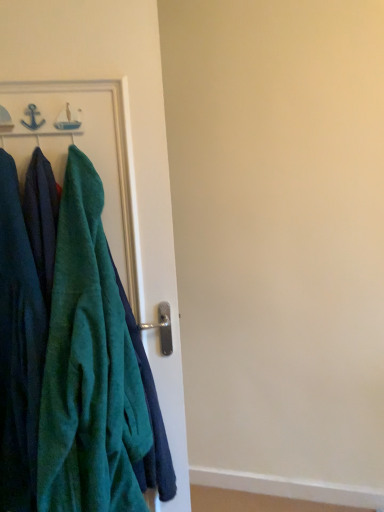
You are a GUI agent. You are given a task and a screenshot of the screen. Output one action in this format:
    pyautogui.click(x=<x>, y=<y>)
    Task: Click on the velvety green towel at left
    
    Given the screenshot: What is the action you would take?
    pyautogui.click(x=89, y=367)

What do you see at coordinates (89, 367) in the screenshot? Image resolution: width=384 pixels, height=512 pixels. I see `velvety green towel at left` at bounding box center [89, 367].

What do you see at coordinates (18, 350) in the screenshot? I see `velvety green robe at left` at bounding box center [18, 350].

At what (x,y) coordinates should I click in order to perform the action: click on velvety green robe at left. Please return your answer as a coordinate pair (x, y). Looking at the image, I should click on (18, 350).

Find the location of a particular element. velvety green towel at left is located at coordinates pos(89,367).

From the picture: Can you confirm if velvety green robe at left is positioned to the left of velvety green towel at left?

Indeed, velvety green robe at left is positioned on the left side of velvety green towel at left.

Does velvety green robe at left lie in front of velvety green towel at left?

No, it is not.

Considering the positions of point (1, 298) and point (136, 361), is point (1, 298) closer or farther from the camera than point (136, 361)?

Point (1, 298) is closer to the camera than point (136, 361).

From the image's perspective, which is below, velvety green robe at left or velvety green towel at left?

velvety green towel at left.

From a real-world perspective, is velvety green robe at left located beneath velvety green towel at left?

Actually, velvety green robe at left is physically above velvety green towel at left in the real world.

Looking at this image, in terms of width, does velvety green robe at left look wider or thinner when compared to velvety green towel at left?

velvety green robe at left is thinner than velvety green towel at left.

Can you confirm if velvety green robe at left is taller than velvety green towel at left?

No, velvety green robe at left is not taller than velvety green towel at left.

Is velvety green robe at left bigger than velvety green towel at left?

Actually, velvety green robe at left might be smaller than velvety green towel at left.

Which is correct: velvety green robe at left is inside velvety green towel at left, or outside of it?

velvety green robe at left is spatially situated outside velvety green towel at left.

Is velvety green robe at left far from velvety green towel at left?

They are positioned close to each other.

Is velvety green robe at left positioned with its back to velvety green towel at left?

No, velvety green robe at left's orientation is not away from velvety green towel at left.

How different are the orientations of velvety green robe at left and velvety green towel at left in degrees?

The angle between the facing direction of velvety green robe at left and the facing direction of velvety green towel at left is 8.4e-05 degrees.

The height and width of the screenshot is (512, 384). Identify the location of towel that appears below the velvety green robe at left (from a real-world perspective). (89, 367).

Visually, is velvety green towel at left positioned to the left or to the right of velvety green robe at left?

In the image, velvety green towel at left appears on the right side of velvety green robe at left.

Relative to velvety green robe at left, is velvety green towel at left in front or behind?

Clearly, velvety green towel at left is in front of velvety green robe at left.

Which is in front, point (97, 341) or point (22, 240)?

The point (97, 341) is closer.

From the image's perspective, is velvety green towel at left under velvety green robe at left?

Yes, from the image's perspective, velvety green towel at left is below velvety green robe at left.

From a real-world perspective, who is located lower, velvety green towel at left or velvety green robe at left?

In real-world perspective, velvety green towel at left is lower.

Which object is wider, velvety green towel at left or velvety green robe at left?

velvety green towel at left.

Can you confirm if velvety green towel at left is shorter than velvety green robe at left?

Incorrect, the height of velvety green towel at left does not fall short of that of velvety green robe at left.

Who is smaller, velvety green towel at left or velvety green robe at left?

velvety green robe at left is smaller.

Is velvety green towel at left inside or outside of velvety green robe at left?

velvety green towel at left is spatially situated outside velvety green robe at left.

Is velvety green towel at left with velvety green robe at left?

No, velvety green towel at left is not next to velvety green robe at left.

Based on the photo, could you tell me if velvety green towel at left is facing velvety green robe at left?

No, velvety green towel at left is not facing towards velvety green robe at left.

How different are the orientations of velvety green towel at left and velvety green robe at left in degrees?

The facing directions of velvety green towel at left and velvety green robe at left are 8.4e-05 degrees apart.

The height and width of the screenshot is (512, 384). I want to click on cloak above the velvety green towel at left (from the image's perspective), so click(x=18, y=350).

I want to click on cloak on the left of velvety green towel at left, so click(18, 350).

You are a GUI agent. You are given a task and a screenshot of the screen. Output one action in this format:
    pyautogui.click(x=<x>, y=<y>)
    Task: Click on the towel on the right of velvety green robe at left
    The image size is (384, 512).
    Given the screenshot: What is the action you would take?
    pyautogui.click(x=89, y=367)